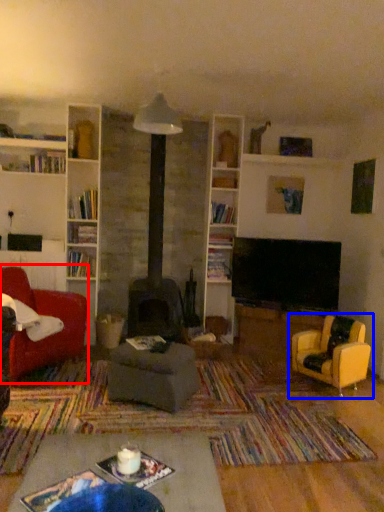
Question: Which point is further to the camera, chair (highlighted by a red box) or chair (highlighted by a blue box)?

Choices:
 (A) chair
 (B) chair

Answer: (B)